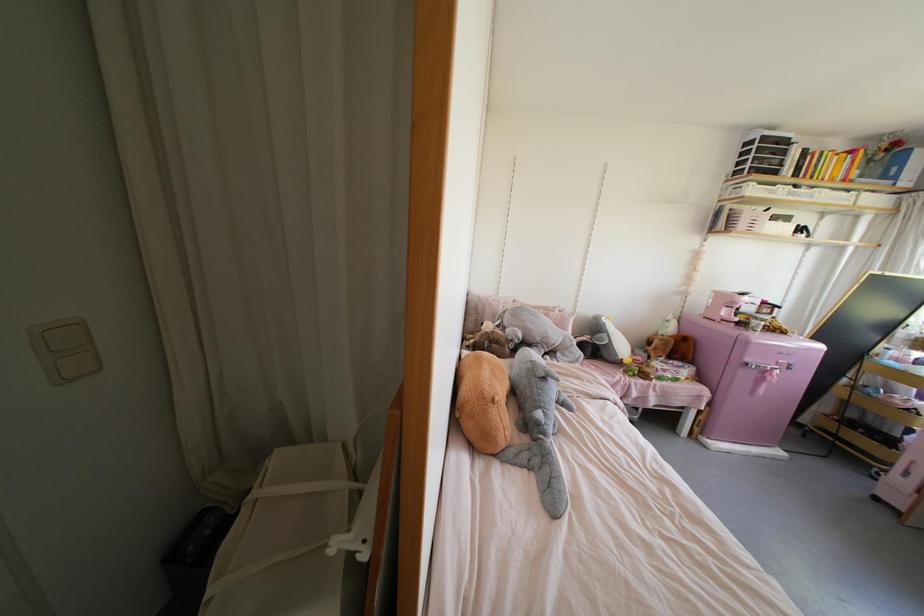
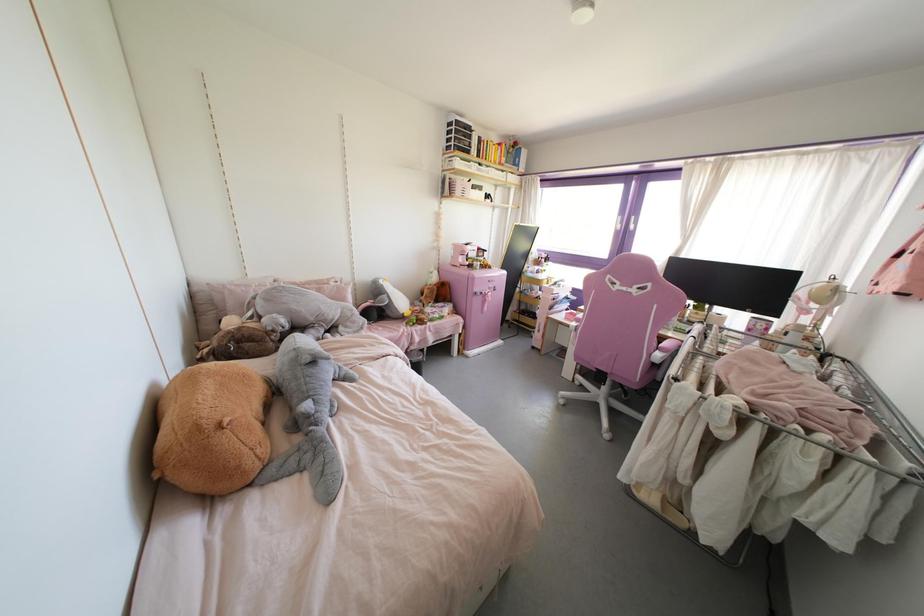
Question: The camera is either moving clockwise (left) or counter-clockwise (right) around the object. The first image is from the beginning of the video and the second image is from the end. Is the camera moving left or right when shooting the video?

Choices:
 (A) Left
 (B) Right

Answer: (A)